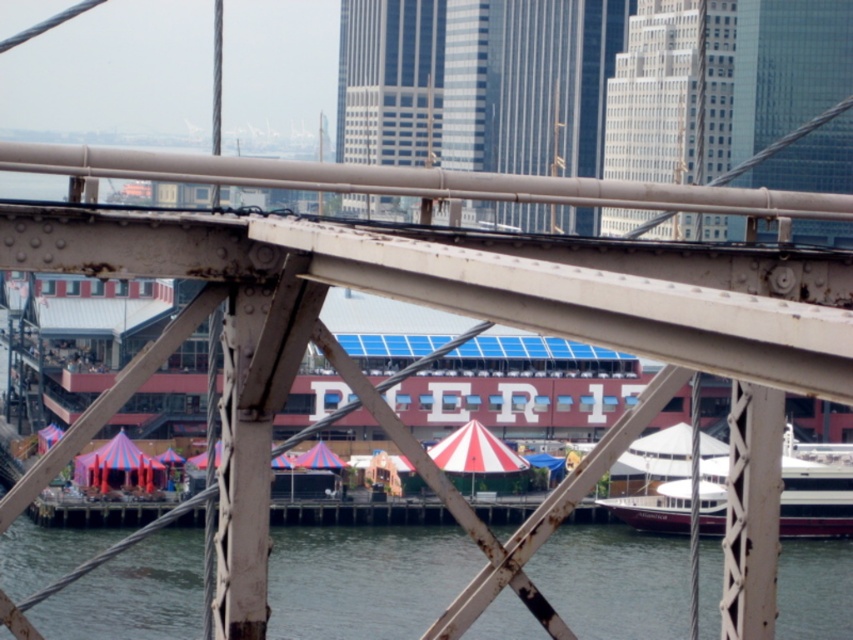
Looking at this image, you are standing on the bridge and want to take a photo of both the white glossy boat at lower right and the clear water at lower center. Which object should you position closer to the front of your photo to include both in the frame?

You should position the clear water at lower center closer to the front of your photo because the white glossy boat at lower right is behind it, allowing both to be captured in the frame.

You are standing on the bridge and want to know where the clear water is located. According to the coordinates provided, where exactly is the clear water at lower center positioned?

The clear water at lower center is located at point coordinates [364,579].